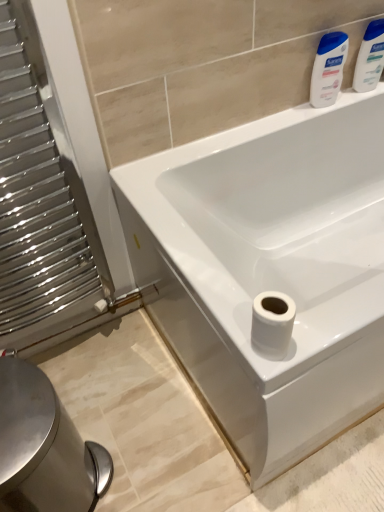
Question: Should I look upward or downward to see white matte toilet paper at lower right?

Choices:
 (A) down
 (B) up

Answer: (A)

Question: Can you confirm if white glossy bathtub at center is thinner than white glossy lotion at upper right, positioned as the 2th cleaning product in right-to-left order?

Choices:
 (A) yes
 (B) no

Answer: (B)

Question: Considering the relative positions of white glossy bathtub at center and white glossy lotion at upper right, which is counted as the 1th cleaning product, starting from the left, in the image provided, is white glossy bathtub at center to the left of white glossy lotion at upper right, which is counted as the 1th cleaning product, starting from the left, from the viewer's perspective?

Choices:
 (A) yes
 (B) no

Answer: (B)

Question: Does white glossy bathtub at center have a lesser height compared to white glossy lotion at upper right, positioned as the 2th cleaning product in right-to-left order?

Choices:
 (A) no
 (B) yes

Answer: (A)

Question: Can you confirm if white glossy bathtub at center is bigger than white glossy lotion at upper right, positioned as the 2th cleaning product in right-to-left order?

Choices:
 (A) no
 (B) yes

Answer: (B)

Question: Does white glossy bathtub at center turn towards white glossy lotion at upper right, positioned as the 2th cleaning product in right-to-left order?

Choices:
 (A) no
 (B) yes

Answer: (A)

Question: Is there a large distance between white glossy bathtub at center and white glossy lotion at upper right, positioned as the 2th cleaning product in right-to-left order?

Choices:
 (A) no
 (B) yes

Answer: (A)

Question: From a real-world perspective, is polished metal radiator at left positioned over white matte toilet paper at lower right based on gravity?

Choices:
 (A) yes
 (B) no

Answer: (B)

Question: Considering the relative sizes of polished metal radiator at left and white matte toilet paper at lower right in the image provided, is polished metal radiator at left taller than white matte toilet paper at lower right?

Choices:
 (A) no
 (B) yes

Answer: (B)

Question: Is polished metal radiator at left smaller than white matte toilet paper at lower right?

Choices:
 (A) no
 (B) yes

Answer: (A)

Question: Is polished metal radiator at left to the right of white matte toilet paper at lower right from the viewer's perspective?

Choices:
 (A) no
 (B) yes

Answer: (A)

Question: Is polished metal radiator at left touching white matte toilet paper at lower right?

Choices:
 (A) yes
 (B) no

Answer: (B)

Question: From the image's perspective, is polished metal radiator at left below white matte toilet paper at lower right?

Choices:
 (A) no
 (B) yes

Answer: (A)

Question: Does white glossy lotion at upper right, which is counted as the 1th cleaning product, starting from the left, lie in front of white glossy bathtub at center?

Choices:
 (A) no
 (B) yes

Answer: (A)